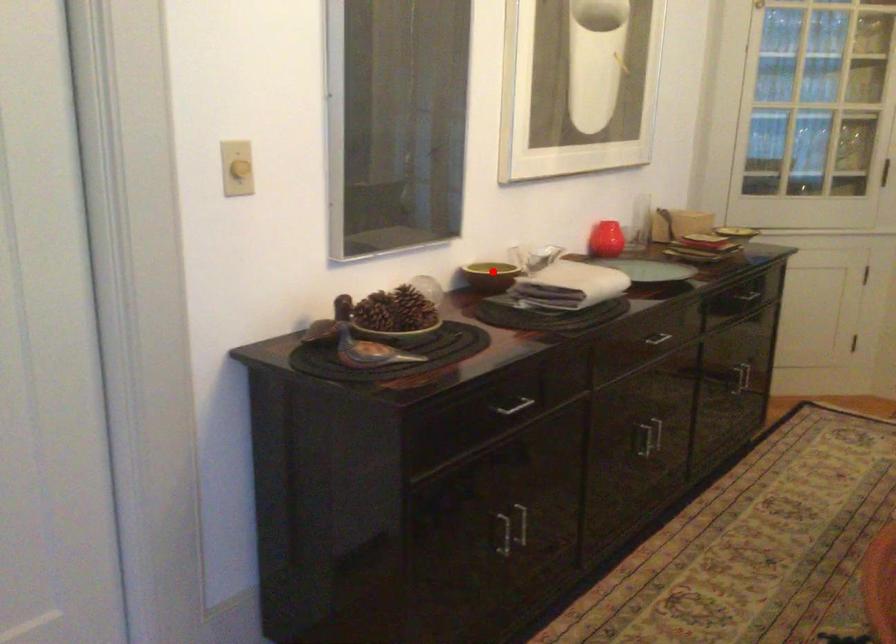
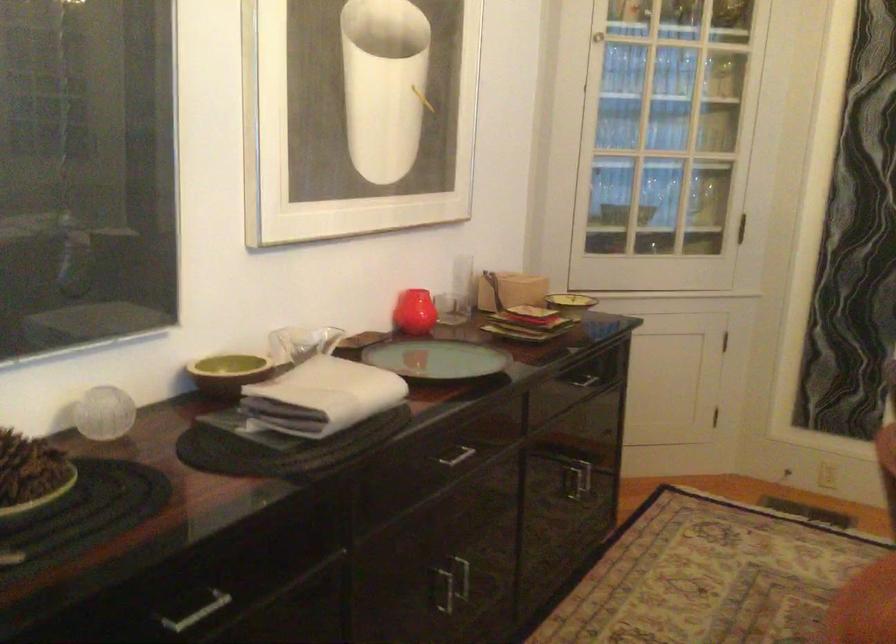
Find the pixel in the second image that matches the highlighted location in the first image.

(228, 373)